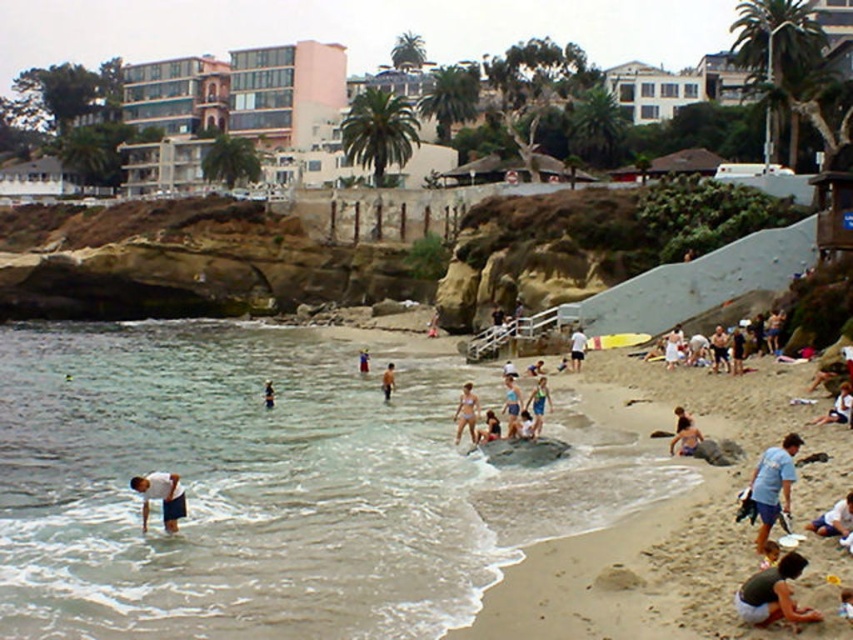
Question: Estimate the real-world distances between objects in this image. Which object is farther from the light blue fabric at lower right?

Choices:
 (A) matte skin person at center
 (B) light blue fabric swimsuit at center
 (C) matte white swimsuit at center

Answer: (A)

Question: Which of the following is the closest to the observer?

Choices:
 (A) (845, 387)
 (B) (606, 536)

Answer: (B)

Question: Is clear water at lower left below matte skin person at center?

Choices:
 (A) no
 (B) yes

Answer: (B)

Question: Observing the image, what is the correct spatial positioning of matte blue swimsuit at center in reference to light brown wooden surfboard at center?

Choices:
 (A) right
 (B) left

Answer: (A)

Question: In this image, where is clear water at lower left located relative to white cotton shirt at lower right?

Choices:
 (A) below
 (B) above

Answer: (B)

Question: Among these objects, which one is farthest from the camera?

Choices:
 (A) dark green fabric at lower right
 (B) tan skin person at center

Answer: (B)